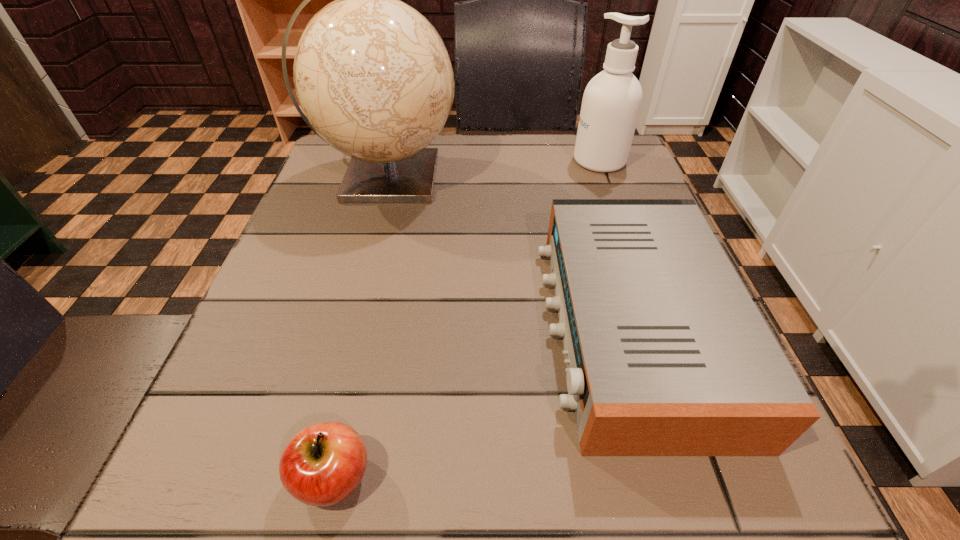
Where is `vacant region located 0.230m on the control panel of the radio receiver`? The image size is (960, 540). vacant region located 0.230m on the control panel of the radio receiver is located at coordinates (401, 327).

This screenshot has width=960, height=540. I want to click on vacant space located 0.100m on the right of the apple, so click(x=455, y=477).

You are a GUI agent. You are given a task and a screenshot of the screen. Output one action in this format:
    pyautogui.click(x=<x>, y=<y>)
    Task: Click on the globe that is positioned at the far edge
    The width and height of the screenshot is (960, 540).
    Given the screenshot: What is the action you would take?
    coord(373,76)

This screenshot has height=540, width=960. What are the coordinates of `cleansing agent present at the far edge` in the screenshot? It's located at (612, 100).

At what (x,y) coordinates should I click in order to perform the action: click on radio receiver at the near edge. Please return your answer as a coordinate pair (x, y). Looking at the image, I should click on (667, 355).

At what (x,y) coordinates should I click in order to perform the action: click on apple at the near edge. Please return your answer as a coordinate pair (x, y). The width and height of the screenshot is (960, 540). Looking at the image, I should click on (323, 464).

Find the location of a particular element. globe that is at the left edge is located at coordinates (373, 76).

Locate an element on the screen. The image size is (960, 540). apple that is at the left edge is located at coordinates (323, 464).

Image resolution: width=960 pixels, height=540 pixels. I want to click on cleansing agent that is at the right edge, so [x=612, y=100].

At what (x,y) coordinates should I click in order to perform the action: click on radio receiver that is at the right edge. Please return your answer as a coordinate pair (x, y). The image size is (960, 540). Looking at the image, I should click on coord(667,355).